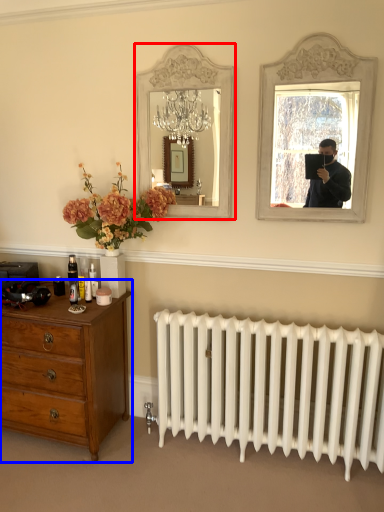
Question: Which object appears farthest to the camera in this image, mirror (highlighted by a red box) or chest of drawers (highlighted by a blue box)?

Choices:
 (A) mirror
 (B) chest of drawers

Answer: (A)